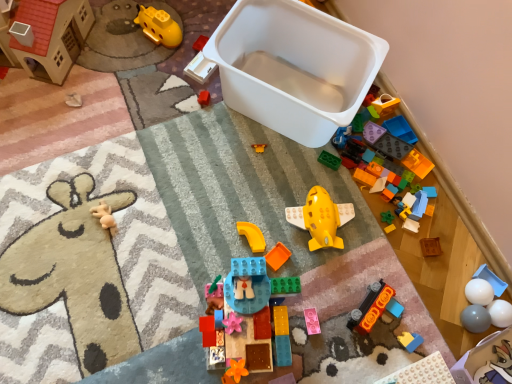
At what (x,y) coordinates should I click in order to perform the action: click on free area in between orange matte block at center, the 11th toy from the right, and cardboard house at upper left, the 1th toy positioned from the left. Please return your answer as a coordinate pair (x, y). Image resolution: width=512 pixels, height=384 pixels. Looking at the image, I should click on (135, 137).